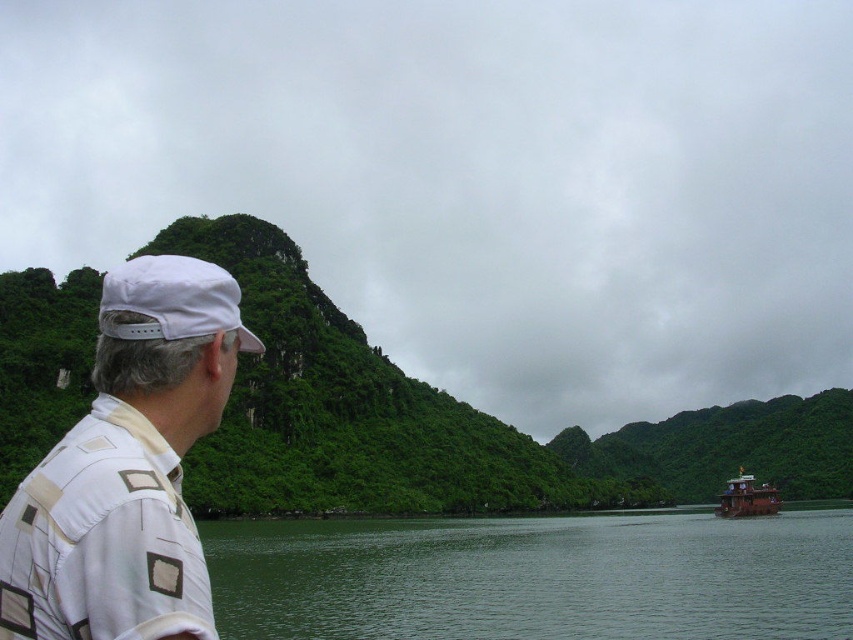
You are a photographer trying to capture the scene from the person standing on the left side. Which object, the green smooth water at lower center or the white fabric cap at upper left, is positioned higher in the image?

The white fabric cap at upper left is positioned higher than the green smooth water at lower center.

Based on the scene, where is the green smooth water at lower center located relative to the white fabric cap at left?

The green smooth water at lower center is located to the right of the white fabric cap at left according to the description.

You are a photographer planning to take a wide shot of the scene. You want to ensure that both the green smooth water at lower center and the brown wooden boat at right are fully visible in the frame. Based on their positions and sizes, do you think the boat will fit within the width of the water in the image?

The green smooth water at lower center might be wider than brown wooden boat at right, so there is a possibility that the boat will fit within the width of the water in the image.